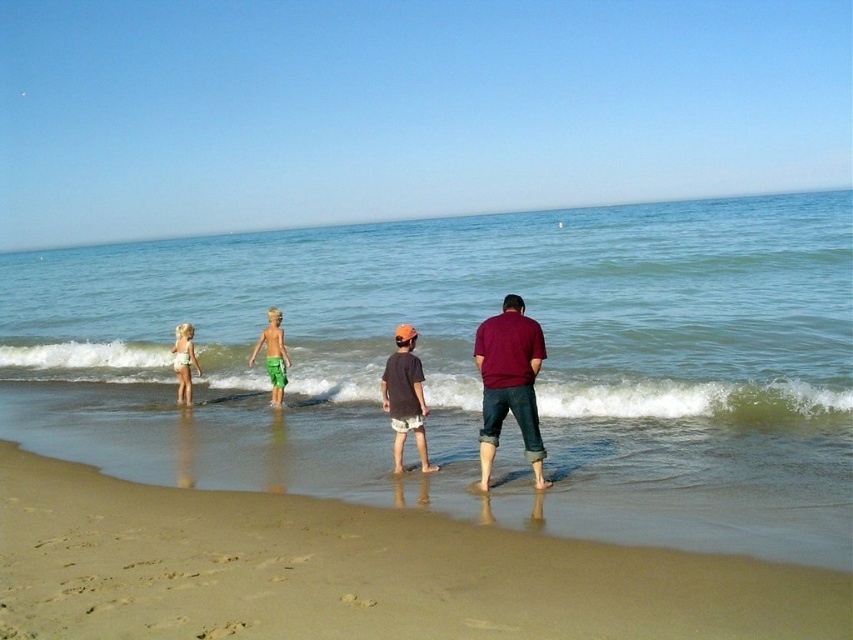
Can you confirm if green cotton shorts at center is positioned above white cloth at left?

Yes, green cotton shorts at center is above white cloth at left.

Which is more to the left, green cotton shorts at center or white cloth at left?

From the viewer's perspective, white cloth at left appears more on the left side.

Does point (282, 358) lie behind point (196, 362)?

No.

Locate an element on the screen. This screenshot has width=853, height=640. green cotton shorts at center is located at coordinates (273, 355).

Does clear blue water at center have a greater width compared to white cloth at left?

Yes, clear blue water at center is wider than white cloth at left.

Is point (115, 428) farther from camera compared to point (189, 404)?

No, it is not.

The height and width of the screenshot is (640, 853). What are the coordinates of `clear blue water at center` in the screenshot? It's located at (473, 364).

Does sandy beach at lower center appear on the right side of maroon fabric shirt at center?

In fact, sandy beach at lower center is to the left of maroon fabric shirt at center.

Who is shorter, sandy beach at lower center or maroon fabric shirt at center?

With less height is sandy beach at lower center.

What do you see at coordinates (357, 572) in the screenshot? The height and width of the screenshot is (640, 853). I see `sandy beach at lower center` at bounding box center [357, 572].

Where is `sandy beach at lower center`? This screenshot has width=853, height=640. sandy beach at lower center is located at coordinates (357, 572).